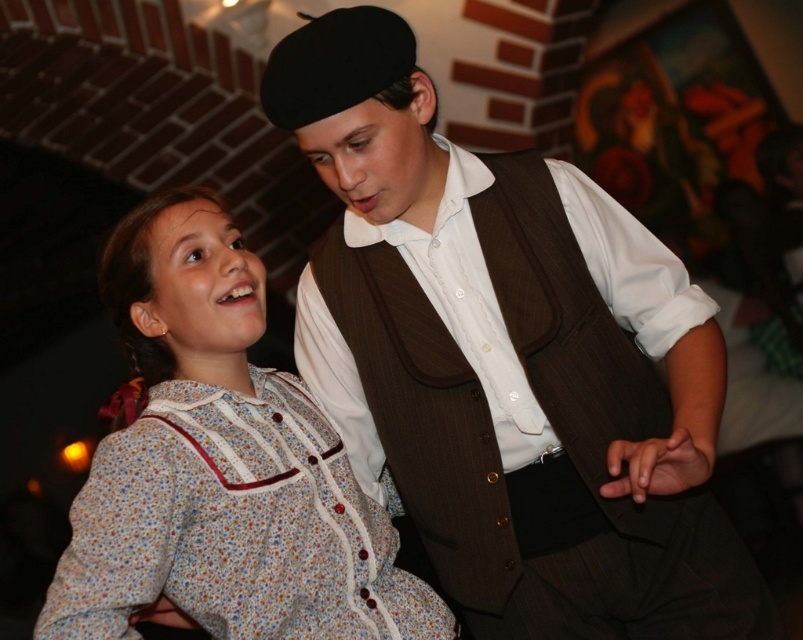
Question: Is brown pinstripe vest at center closer to camera compared to floral cotton dress at center?

Choices:
 (A) no
 (B) yes

Answer: (A)

Question: Which of the following is the closest to the observer?

Choices:
 (A) pyautogui.click(x=475, y=339)
 (B) pyautogui.click(x=159, y=449)

Answer: (B)

Question: Which point is closer to the camera taking this photo?

Choices:
 (A) (600, 637)
 (B) (104, 486)

Answer: (B)

Question: Which point is farther to the camera?

Choices:
 (A) floral cotton dress at center
 (B) brown pinstripe vest at center

Answer: (B)

Question: Is brown pinstripe vest at center positioned at the back of floral cotton dress at center?

Choices:
 (A) no
 (B) yes

Answer: (B)

Question: Is brown pinstripe vest at center wider than floral cotton dress at center?

Choices:
 (A) yes
 (B) no

Answer: (A)